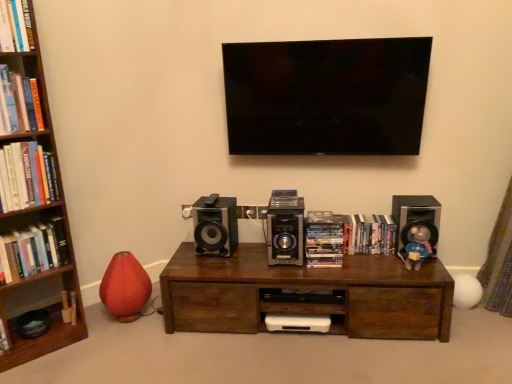
At what (x,y) coordinates should I click in order to perform the action: click on free spot to the right of wooden bookcase at left. Please return your answer as a coordinate pair (x, y). Image resolution: width=512 pixels, height=384 pixels. Looking at the image, I should click on (104, 345).